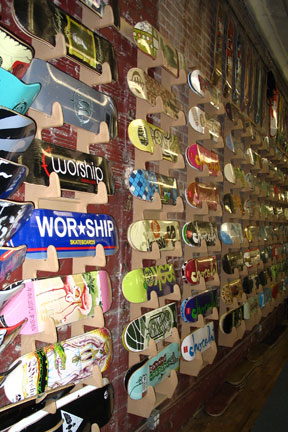
Locate an element on the screen. wood floor is located at coordinates (281, 356), (259, 383), (243, 413).